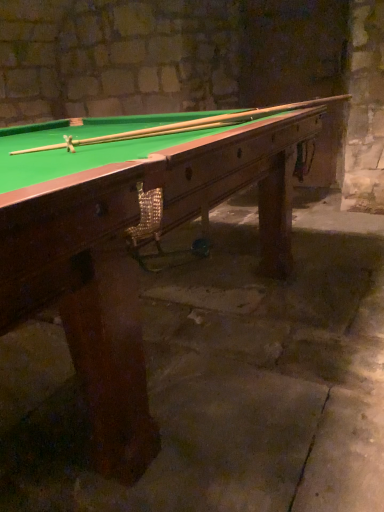
Measure the distance between wooden billiard table at center and camera.

wooden billiard table at center is 21.99 inches from camera.

Locate an element on the screen. The image size is (384, 512). wooden billiard table at center is located at coordinates (131, 234).

This screenshot has width=384, height=512. Describe the element at coordinates (131, 234) in the screenshot. I see `wooden billiard table at center` at that location.

What is the approximate height of wooden billiard table at center?

It is 35.30 inches.

Describe the element at coordinates (182, 125) in the screenshot. I see `wooden cue at upper center` at that location.

Find the location of a particular element. This screenshot has height=512, width=384. wooden cue at upper center is located at coordinates (182, 125).

This screenshot has height=512, width=384. Find the location of `wooden billiard table at center`. wooden billiard table at center is located at coordinates (131, 234).

Considering the relative positions of wooden cue at upper center and wooden billiard table at center in the image provided, is wooden cue at upper center to the right of wooden billiard table at center from the viewer's perspective?

Yes, wooden cue at upper center is to the right of wooden billiard table at center.

Which is in front, wooden cue at upper center or wooden billiard table at center?

Positioned in front is wooden billiard table at center.

Considering the positions of points (139, 133) and (90, 331), is point (139, 133) farther from camera compared to point (90, 331)?

Yes, point (139, 133) is farther from viewer.

From the image's perspective, is wooden cue at upper center above wooden billiard table at center?

Yes, from the image's perspective, wooden cue at upper center is above wooden billiard table at center.

From a real-world perspective, is wooden cue at upper center below wooden billiard table at center?

Incorrect, from a real-world perspective, wooden cue at upper center is higher than wooden billiard table at center.

Considering the sizes of wooden cue at upper center and wooden billiard table at center in the image, is wooden cue at upper center wider or thinner than wooden billiard table at center?

Considering their sizes, wooden cue at upper center looks slimmer than wooden billiard table at center.

Considering the sizes of wooden cue at upper center and wooden billiard table at center in the image, is wooden cue at upper center taller or shorter than wooden billiard table at center?

In the image, wooden cue at upper center appears to be shorter than wooden billiard table at center.

Considering the relative sizes of wooden cue at upper center and wooden billiard table at center in the image provided, is wooden cue at upper center smaller than wooden billiard table at center?

Yes.

Is wooden cue at upper center spatially inside wooden billiard table at center, or outside of it?

A: wooden cue at upper center is contained in wooden billiard table at center.

Is wooden cue at upper center beside wooden billiard table at center?

wooden cue at upper center and wooden billiard table at center are clearly separated.

Does wooden cue at upper center turn towards wooden billiard table at center?

Yes, wooden cue at upper center faces towards wooden billiard table at center.

How different are the orientations of wooden cue at upper center and wooden billiard table at center in degrees?

62.5 degrees.

In the image, there is a wooden cue at upper center. Find the location of `billiard table below it (from the image's perspective)`. billiard table below it (from the image's perspective) is located at coordinates click(131, 234).

Is wooden billiard table at center to the right of wooden cue at upper center from the viewer's perspective?

In fact, wooden billiard table at center is to the left of wooden cue at upper center.

Between wooden billiard table at center and wooden cue at upper center, which one is positioned behind?

wooden cue at upper center is behind.

Does point (259, 270) appear closer or farther from the camera than point (256, 113)?

Clearly, point (259, 270) is more distant from the camera than point (256, 113).

Based on the photo, from the image's perspective, which one is positioned lower, wooden billiard table at center or wooden cue at upper center?

wooden billiard table at center.

Looking at this image, from a real-world perspective, between wooden billiard table at center and wooden cue at upper center, who is vertically higher?

wooden cue at upper center is physically above.

Does wooden billiard table at center have a lesser width compared to wooden cue at upper center?

In fact, wooden billiard table at center might be wider than wooden cue at upper center.

Can you confirm if wooden billiard table at center is taller than wooden cue at upper center?

Yes.

Considering the relative sizes of wooden billiard table at center and wooden cue at upper center in the image provided, is wooden billiard table at center smaller than wooden cue at upper center?

Actually, wooden billiard table at center might be larger than wooden cue at upper center.

Would you say wooden cue at upper center is part of wooden billiard table at center's contents?

Yes, wooden cue at upper center can be found within wooden billiard table at center.

Is wooden billiard table at center far from wooden cue at upper center?

No, there isn't a large distance between wooden billiard table at center and wooden cue at upper center.

Is wooden billiard table at center positioned with its back to wooden cue at upper center?

No.

How distant is wooden billiard table at center from wooden cue at upper center?

They are 11.19 inches apart.

Where is `cue that is behind the wooden billiard table at center`? cue that is behind the wooden billiard table at center is located at coordinates (182, 125).

I want to click on billiard table that is under the wooden cue at upper center (from a real-world perspective), so click(131, 234).

In order to click on billiard table lying on the left of wooden cue at upper center in this screenshot , I will do `click(131, 234)`.